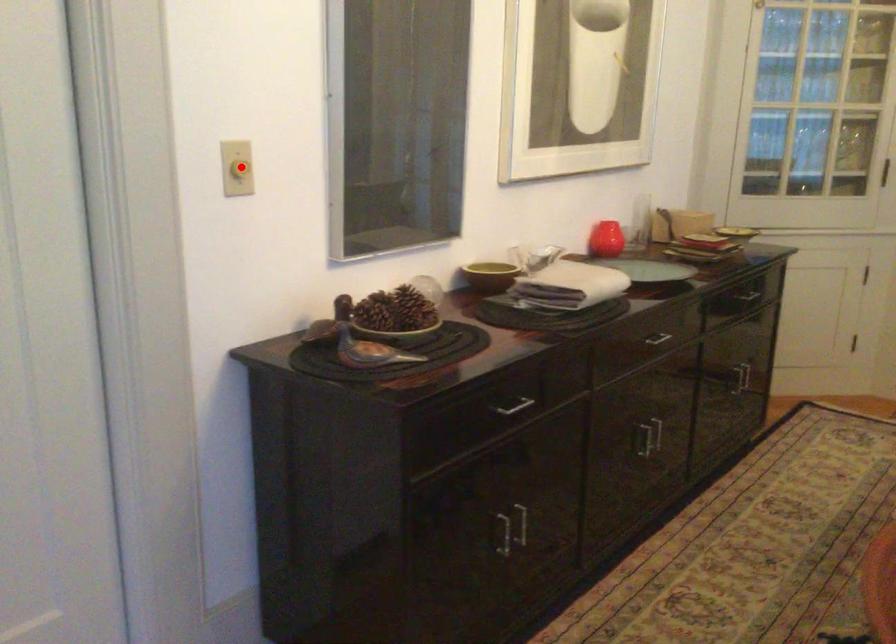
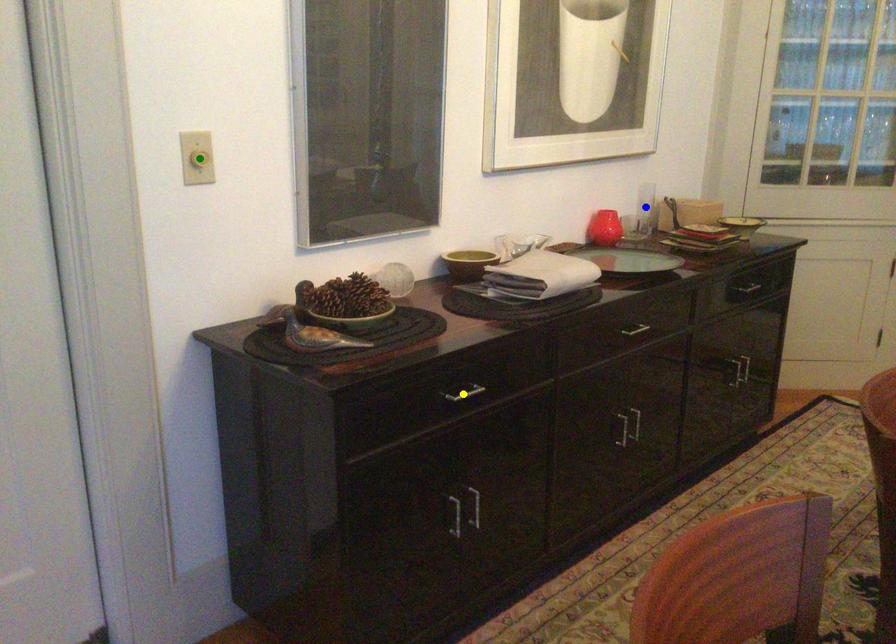
Question: I am providing you with two images of the same scene from different viewpoints. A red point is marked on the first image. You are given multiple points on the second image. Which mark in image 2 goes with the point in image 1?

Choices:
 (A) yellow point
 (B) green point
 (C) blue point

Answer: (B)